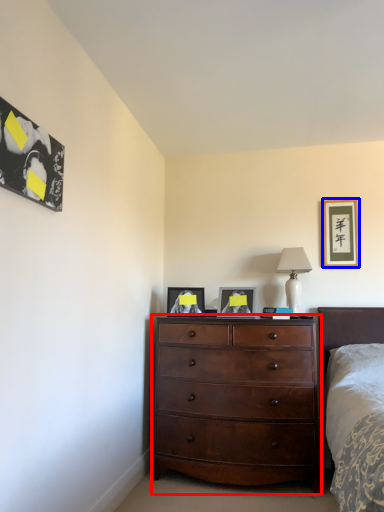
Question: Which object is further to the camera taking this photo, chest of drawers (highlighted by a red box) or picture frame (highlighted by a blue box)?

Choices:
 (A) chest of drawers
 (B) picture frame

Answer: (B)